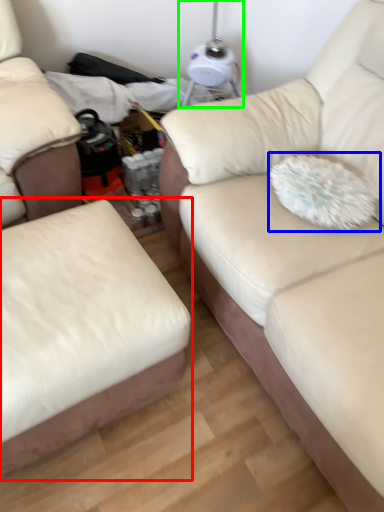
Question: Which is farther away from studio couch (highlighted by a red box)? throw pillow (highlighted by a blue box) or table lamp (highlighted by a green box)?

Choices:
 (A) throw pillow
 (B) table lamp

Answer: (B)